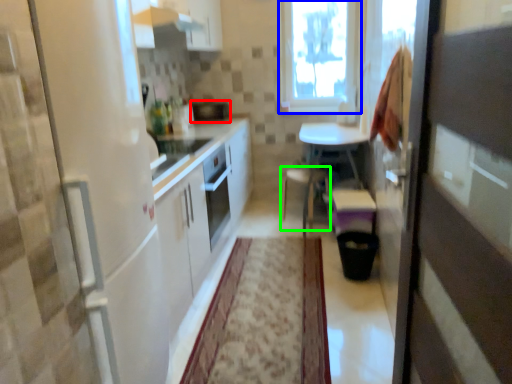
Question: Which is nearer to the appliance (highlighted by a red box)? window (highlighted by a blue box) or chair (highlighted by a green box).

Choices:
 (A) window
 (B) chair

Answer: (A)